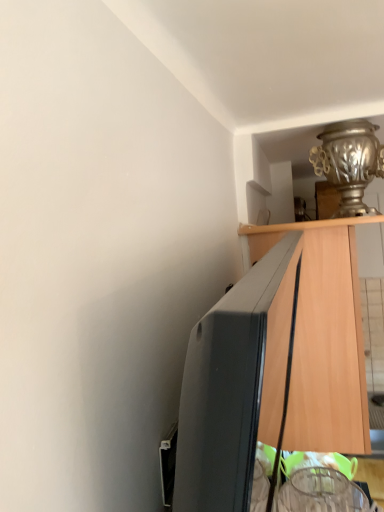
Question: Does wooden cabinet at right have a greater width compared to silver metallic vase at upper right?

Choices:
 (A) yes
 (B) no

Answer: (A)

Question: Is silver metallic vase at upper right located within wooden cabinet at right?

Choices:
 (A) yes
 (B) no

Answer: (B)

Question: Is wooden cabinet at right thinner than silver metallic vase at upper right?

Choices:
 (A) no
 (B) yes

Answer: (A)

Question: From a real-world perspective, is wooden cabinet at right located higher than silver metallic vase at upper right?

Choices:
 (A) yes
 (B) no

Answer: (B)

Question: Is wooden cabinet at right located outside silver metallic vase at upper right?

Choices:
 (A) no
 (B) yes

Answer: (B)

Question: Considering the relative positions of wooden cabinet at right and silver metallic vase at upper right in the image provided, is wooden cabinet at right in front of silver metallic vase at upper right?

Choices:
 (A) yes
 (B) no

Answer: (A)

Question: Considering the relative sizes of silver metallic vase at upper right and wooden cabinet at right in the image provided, is silver metallic vase at upper right wider than wooden cabinet at right?

Choices:
 (A) yes
 (B) no

Answer: (B)

Question: Can we say silver metallic vase at upper right lies outside wooden cabinet at right?

Choices:
 (A) no
 (B) yes

Answer: (B)

Question: Is wooden cabinet at right located within silver metallic vase at upper right?

Choices:
 (A) yes
 (B) no

Answer: (B)

Question: Can you confirm if silver metallic vase at upper right is taller than wooden cabinet at right?

Choices:
 (A) yes
 (B) no

Answer: (B)

Question: From a real-world perspective, is silver metallic vase at upper right located higher than wooden cabinet at right?

Choices:
 (A) yes
 (B) no

Answer: (A)

Question: Considering the relative sizes of silver metallic vase at upper right and wooden cabinet at right in the image provided, is silver metallic vase at upper right bigger than wooden cabinet at right?

Choices:
 (A) no
 (B) yes

Answer: (A)

Question: Looking at the image, does wooden cabinet at right seem bigger or smaller compared to silver metallic vase at upper right?

Choices:
 (A) small
 (B) big

Answer: (B)